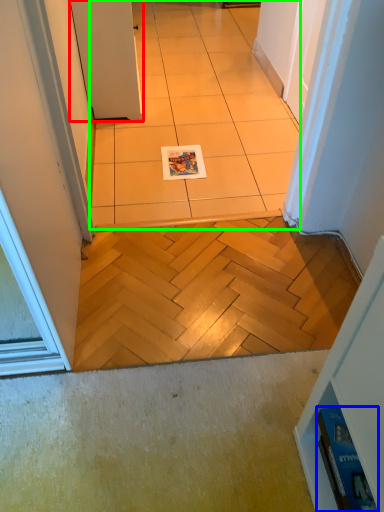
Question: Considering the real-world distances, which object is closest to door (highlighted by a red box)? magazine (highlighted by a blue box) or ceramic tile (highlighted by a green box).

Choices:
 (A) magazine
 (B) ceramic tile

Answer: (B)